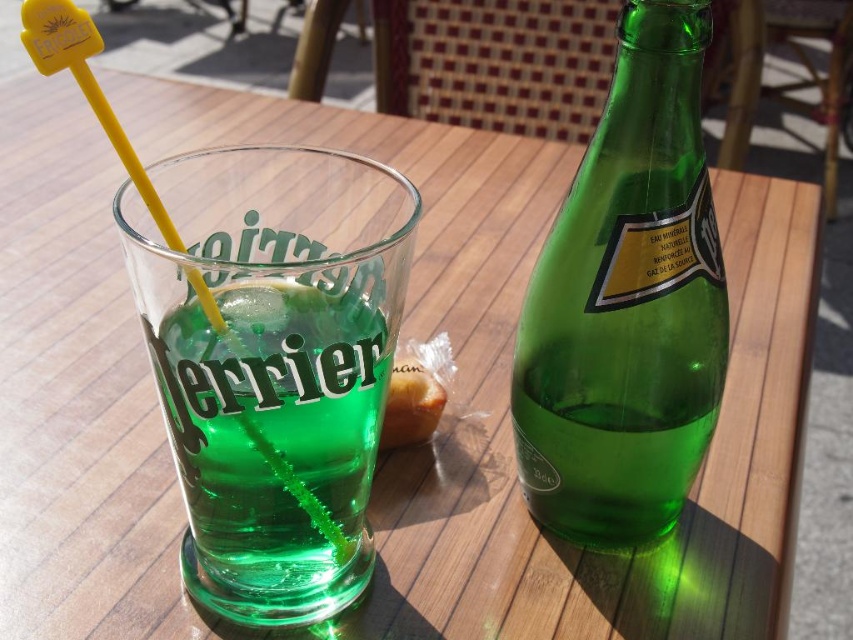
Which is more to the left, green glass bottle at right or bread at center?

bread at center is more to the left.

Does green glass bottle at right appear on the right side of bread at center?

Indeed, green glass bottle at right is positioned on the right side of bread at center.

What do you see at coordinates (627, 304) in the screenshot? I see `green glass bottle at right` at bounding box center [627, 304].

The image size is (853, 640). Identify the location of green glass bottle at right. (627, 304).

Is point (207, 410) positioned before point (437, 392)?

Yes, it is.

Consider the image. Is green glass at center below bread at center?

Correct, green glass at center is located below bread at center.

Does point (314, 346) come closer to viewer compared to point (424, 369)?

Yes, point (314, 346) is closer to viewer.

The width and height of the screenshot is (853, 640). I want to click on green glass at center, so click(x=273, y=445).

From the picture: How distant is green glass bottle at right from green glass at center?

green glass bottle at right and green glass at center are 2.62 inches apart.

Where is `green glass bottle at right`? green glass bottle at right is located at coordinates (627, 304).

What are the coordinates of `green glass bottle at right` in the screenshot? It's located at click(627, 304).